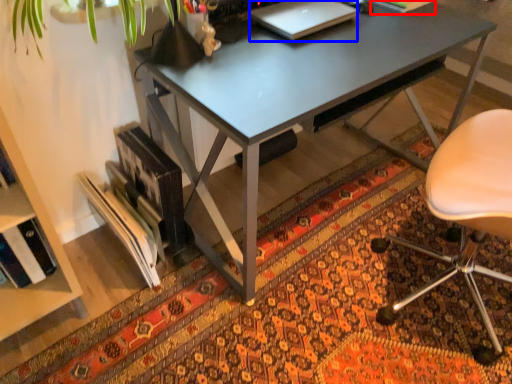
Question: Among these objects, which one is farthest to the camera, book (highlighted by a red box) or laptop (highlighted by a blue box)?

Choices:
 (A) book
 (B) laptop

Answer: (A)